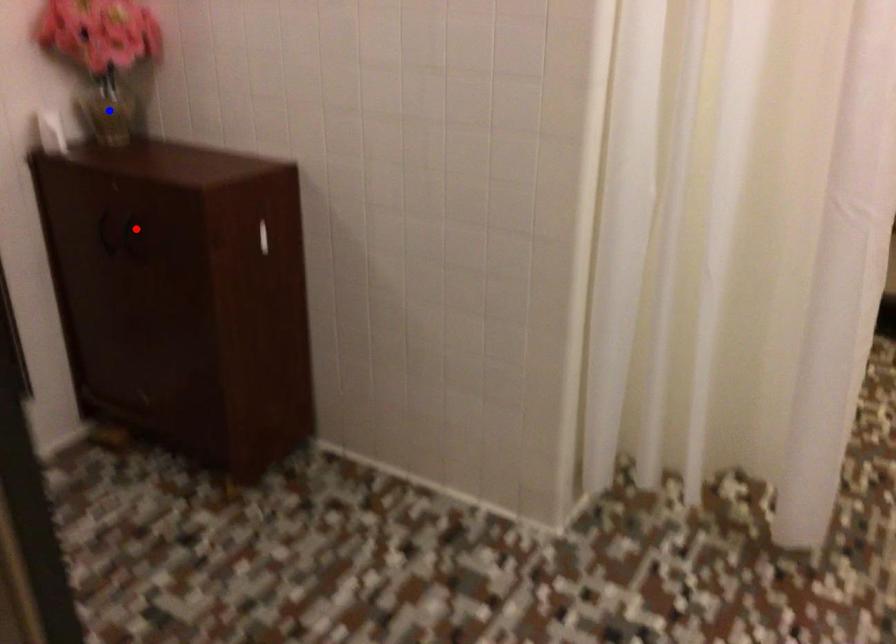
Question: Which of the two points in the image is closer to the camera?

Choices:
 (A) Blue point is closer.
 (B) Red point is closer.

Answer: (B)